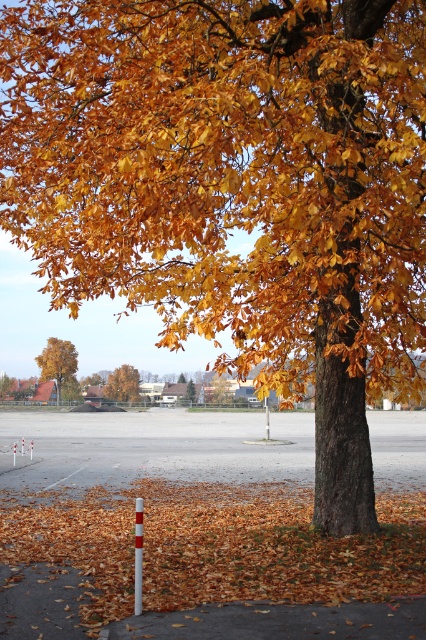
Question: Is yellow/golden wood at left bigger than golden textured leaves at center?

Choices:
 (A) no
 (B) yes

Answer: (B)

Question: Which point is closer to the camera taking this photo?

Choices:
 (A) (74, 500)
 (B) (117, 372)
 (C) (58, 346)

Answer: (A)

Question: Does brown leaf litter at lower center have a smaller size compared to golden textured leaves at center?

Choices:
 (A) yes
 (B) no

Answer: (B)

Question: Which object is farther from the camera taking this photo?

Choices:
 (A) golden textured leaves at center
 (B) yellow/golden wood at left
 (C) golden leafy tree at center
 (D) brown leaf litter at lower center

Answer: (A)

Question: Which point is farther from the camera taking this photo?

Choices:
 (A) (127, 611)
 (B) (43, 365)

Answer: (B)

Question: Does brown leaf litter at lower center appear under golden leafy tree at center?

Choices:
 (A) yes
 (B) no

Answer: (A)